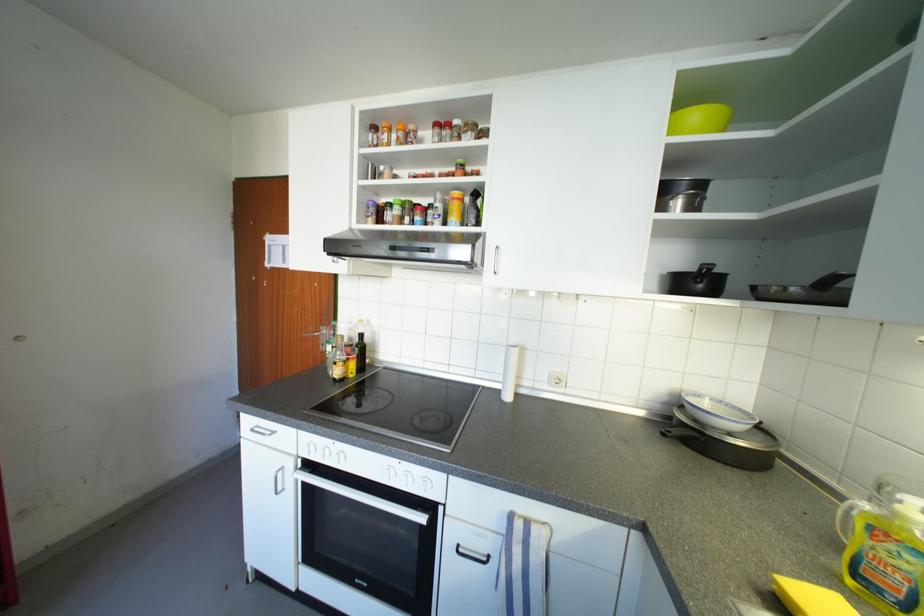
Where would you pull the oven door handle? Please return your answer as a coordinate pair (x, y).

(361, 496)